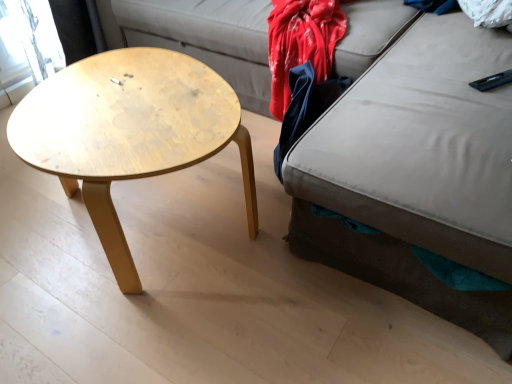
Locate an element on the screen. This screenshot has width=512, height=384. vacant space that is to the left of dark blue fabric at right is located at coordinates (232, 186).